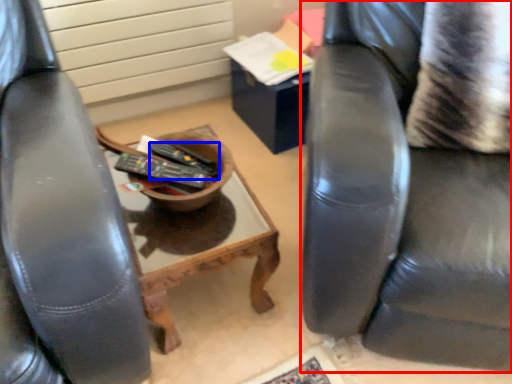
Question: Among these objects, which one is nearest to the camera, chair (highlighted by a red box) or remote control (highlighted by a blue box)?

Choices:
 (A) chair
 (B) remote control

Answer: (A)